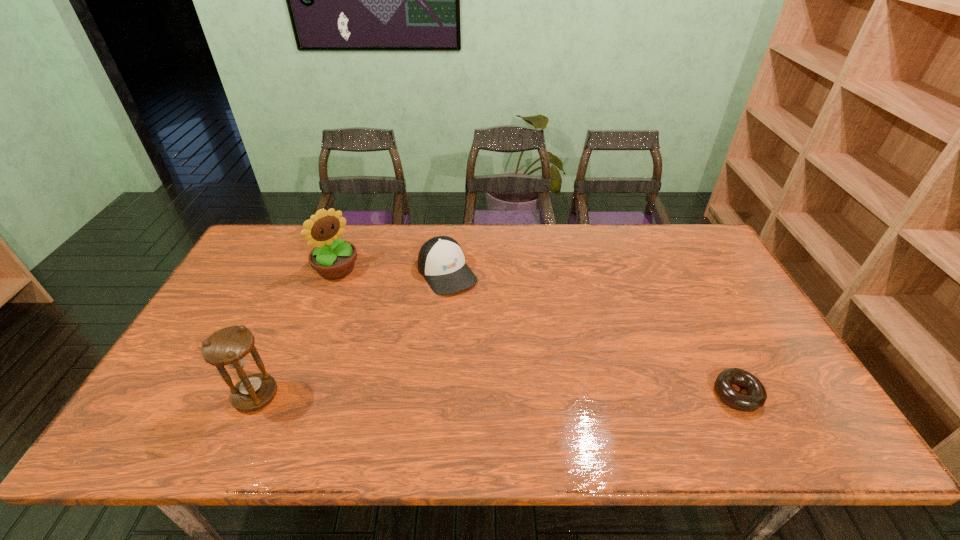
Identify the location of vacant region that satisfies the following two spatial constraints: 1. on the front side of the sunflower; 2. on the left side of the cap. (335, 273).

Find the location of a particular element. free spot that satisfies the following two spatial constraints: 1. on the front side of the doughnut; 2. on the right side of the sunflower is located at coordinates (288, 395).